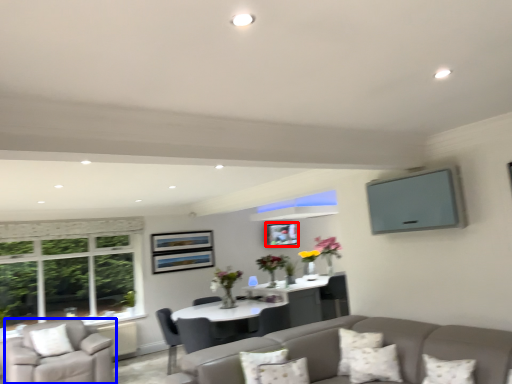
Question: Which object appears farthest to the camera in this image, picture frame (highlighted by a red box) or chair (highlighted by a blue box)?

Choices:
 (A) picture frame
 (B) chair

Answer: (A)